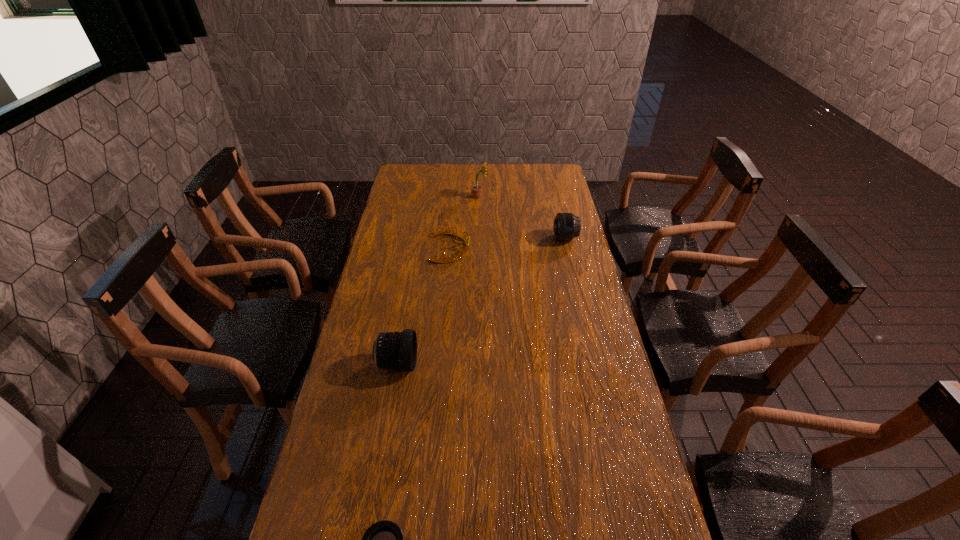
This screenshot has height=540, width=960. Identify the location of sunflower. (476, 190).

At what (x,y) coordinates should I click in order to perform the action: click on the farthest object. Please return your answer as a coordinate pair (x, y). Looking at the image, I should click on (476, 190).

At what (x,y) coordinates should I click in order to perform the action: click on the second nearest telephoto lens. Please return your answer as a coordinate pair (x, y). Looking at the image, I should click on (396, 350).

This screenshot has height=540, width=960. What are the coordinates of `the rightmost object` in the screenshot? It's located at (566, 227).

Locate an element on the screen. This screenshot has width=960, height=540. the farthest telephoto lens is located at coordinates (566, 227).

Where is `the second shortest object`? The height and width of the screenshot is (540, 960). the second shortest object is located at coordinates (441, 232).

This screenshot has width=960, height=540. Identify the location of vacant point located on the face of the tallest object. (503, 196).

Locate an element on the screen. The height and width of the screenshot is (540, 960). free space located at the front element of the second farthest telephoto lens is located at coordinates (464, 363).

The height and width of the screenshot is (540, 960). I want to click on vacant area situated 0.350m on the front-facing side of the farthest telephoto lens, so click(471, 238).

Where is `vacant space located on the front-facing side of the farthest telephoto lens`? The width and height of the screenshot is (960, 540). vacant space located on the front-facing side of the farthest telephoto lens is located at coordinates (520, 238).